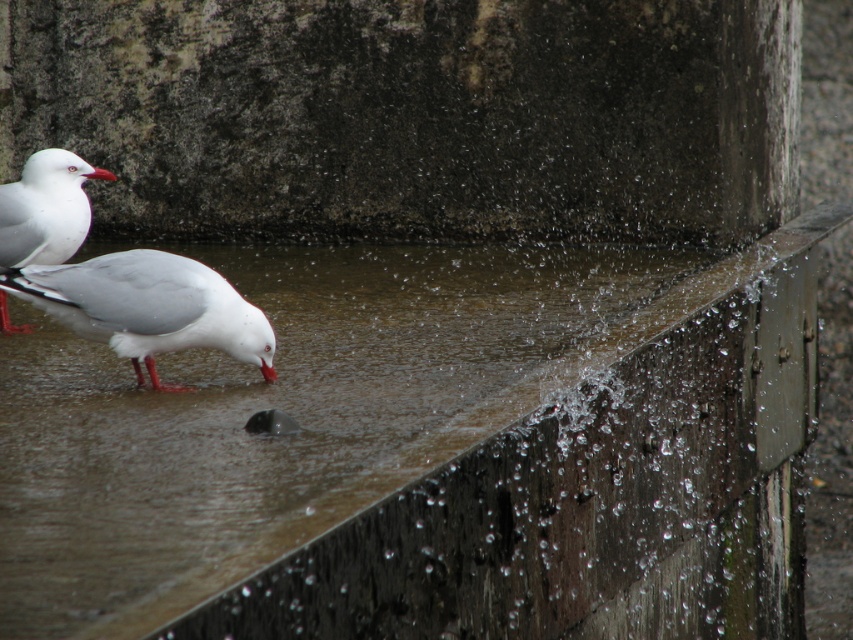
You are holding a camera and want to take a photo of the white matte bird at lower left. If you are currently standing 14.26 feet away from it, is that the ideal distance for a closeup shot?

The white matte bird at lower left and camera are 14.26 feet apart from each other. For a closeup shot, you would typically need to be closer than 14.26 feet to capture detailed features like the bird s feathers or facial expressions. Therefore, moving closer would be advisable for a better closeup.